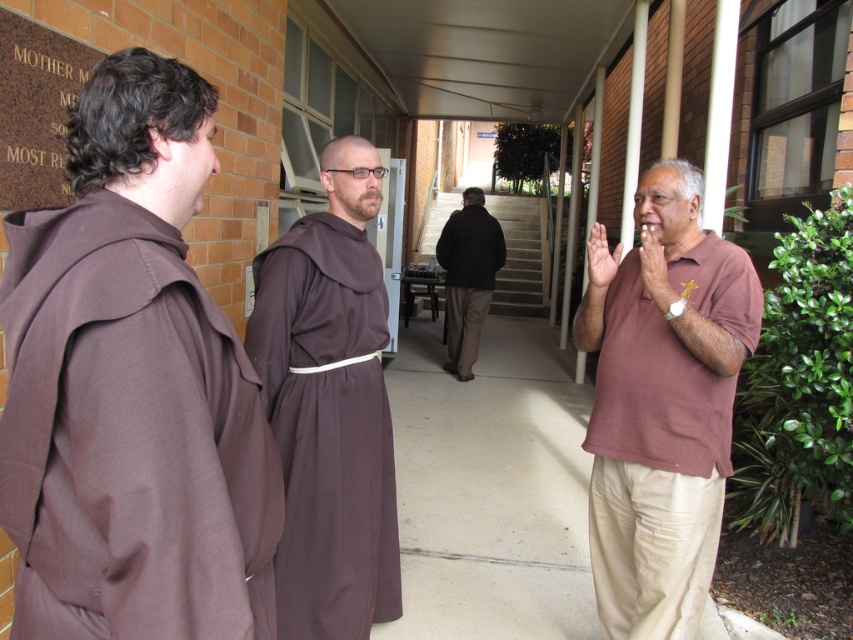
Does point (151, 548) come farther from viewer compared to point (364, 432)?

No, (151, 548) is in front of (364, 432).

Does brown cotton robe at left have a lesser height compared to brown clothed monk at center?

Yes, brown cotton robe at left is shorter than brown clothed monk at center.

Which is in front, point (221, 497) or point (300, 458)?

Point (221, 497) is more forward.

Find the location of a particular element. brown cotton robe at left is located at coordinates (129, 436).

Is brown cotton robe at left bigger than brown cotton shirt at right?

No, brown cotton robe at left is not bigger than brown cotton shirt at right.

How distant is brown cotton robe at left from brown cotton shirt at right?

They are 1.56 meters apart.

This screenshot has height=640, width=853. I want to click on brown cotton robe at left, so click(129, 436).

Consider the image. Does brown cotton shirt at right have a greater width compared to dark brown jacket at center?

No, brown cotton shirt at right is not wider than dark brown jacket at center.

Who is more forward, (747, 321) or (463, 227)?

Positioned in front is point (747, 321).

Does point (669, 493) come in front of point (447, 236)?

Yes, it is.

The image size is (853, 640). Find the location of `brown cotton shirt at right`. brown cotton shirt at right is located at coordinates (660, 404).